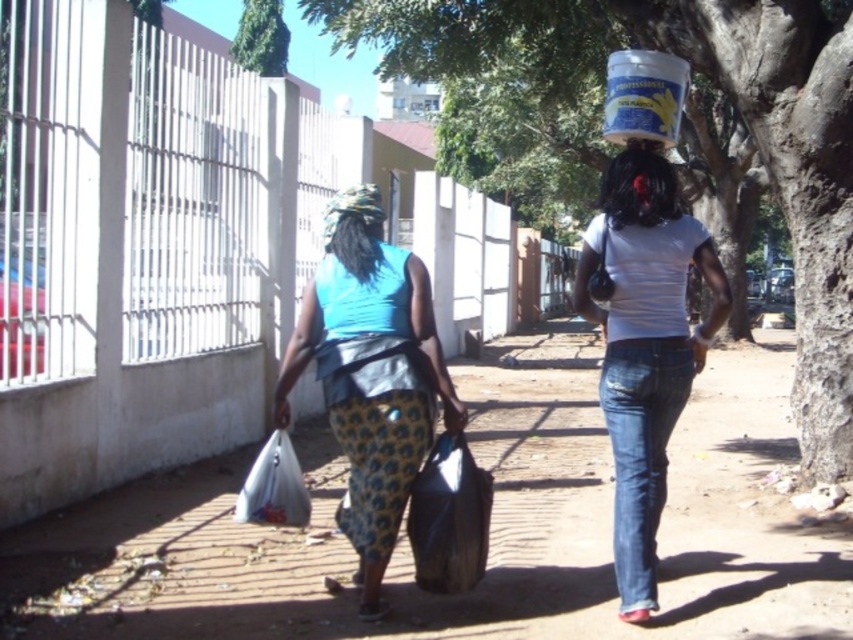
You are a photographer trying to capture a photo of the blue fabric dress at center and the black plastic bag at center. Which object should you focus on if you want to ensure both are in frame without moving the camera?

You should focus on the blue fabric dress at center because it is wider than the black plastic bag at center, so centering it would help keep both in frame.

You are a photographer trying to capture both the black plastic bag at center and the patterned fabric headscarf at center in a single frame. Given that your camera can only focus on objects wider than 10 cm, will both items be in focus?

The black plastic bag at center is wider than the patterned fabric headscarf at center. Since the camera focuses on objects wider than 10 cm, both items will be in focus as long as the black plastic bag meets the width requirement. However, without knowing the exact width of the black plastic bag, we can only confirm that the black plastic bag is wider than the patterned fabric headscarf. If the black plastic bag is at least 10 cm wide, then both would be in focus.